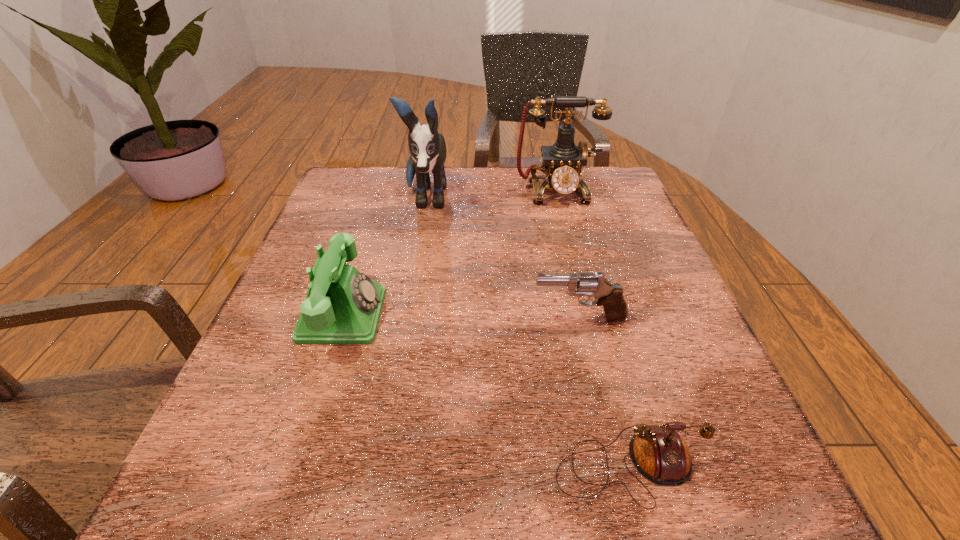
Image resolution: width=960 pixels, height=540 pixels. I want to click on empty location between the shortest telephone and the second tallest object, so click(592, 329).

The image size is (960, 540). I want to click on empty space between the pistol and the second nearest telephone, so click(461, 316).

The image size is (960, 540). Find the location of `vacant area that lies between the shortest object and the leftmost telephone`. vacant area that lies between the shortest object and the leftmost telephone is located at coordinates (486, 391).

Locate an element on the screen. vacant area that lies between the fourth tallest object and the puppy is located at coordinates (503, 259).

The image size is (960, 540). What are the coordinates of `blank region between the pistol and the puppy` in the screenshot? It's located at (503, 259).

Locate an element on the screen. empty space that is in between the second shortest object and the third shortest object is located at coordinates (461, 316).

Where is `vacant region between the leftmost telephone and the shortest object`? vacant region between the leftmost telephone and the shortest object is located at coordinates (486, 391).

Locate which object ranks in proximity to the tallest telephone. Please provide its 2D coordinates. Your answer should be formatted as a tuple, i.e. [(x, y)], where the tuple contains the x and y coordinates of a point satisfying the conditions above.

[(427, 147)]

The image size is (960, 540). Identify the location of object that is the closest one to the tallest telephone. 427,147.

Where is `telephone that stands as the closest to the fourth shortest object`? The width and height of the screenshot is (960, 540). telephone that stands as the closest to the fourth shortest object is located at coordinates (343, 306).